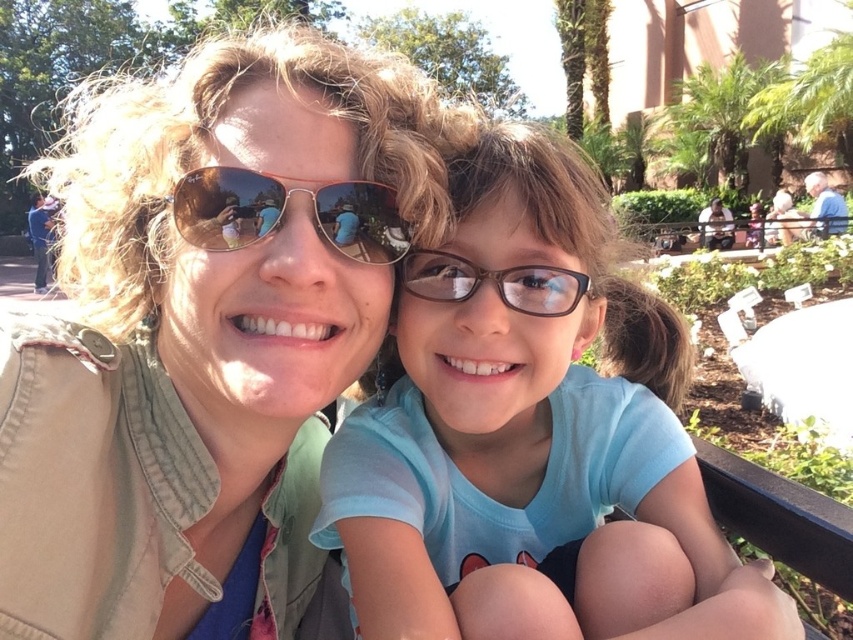
Is light blue fabric shirt at center smaller than gold reflective sunglasses at center?

No.

Which is behind, point (465, 257) or point (238, 202)?

The point (465, 257) is more distant.

Which is behind, point (547, 568) or point (221, 218)?

The point (547, 568) is behind.

Image resolution: width=853 pixels, height=640 pixels. Find the location of `light blue fabric shirt at center`. light blue fabric shirt at center is located at coordinates (532, 436).

Does point (276, 520) come behind point (407, 269)?

Yes, point (276, 520) is behind point (407, 269).

You are a GUI agent. You are given a task and a screenshot of the screen. Output one action in this format:
    pyautogui.click(x=<x>, y=<y>)
    Task: Click on the matte khaki jacket at center
    Image resolution: width=853 pixels, height=640 pixels.
    Given the screenshot: What is the action you would take?
    pyautogui.click(x=206, y=337)

Measure the distance between matte khaki jacket at center and camera.

A distance of 30.72 inches exists between matte khaki jacket at center and camera.

Does point (289, 465) lie behind point (367, 212)?

Yes, it is behind point (367, 212).

I want to click on matte khaki jacket at center, so click(x=206, y=337).